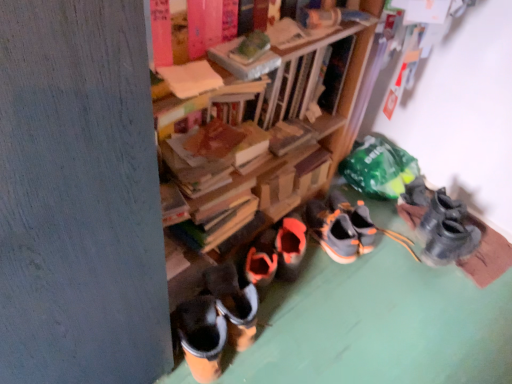
You are a GUI agent. You are given a task and a screenshot of the screen. Output one action in this format:
    pyautogui.click(x=<x>, y=<y>)
    Task: Click on the free spot behind matte gray sneakers at right, acting as the third footwear starting from the left
    This screenshot has height=384, width=512.
    Given the screenshot: What is the action you would take?
    pos(423,200)